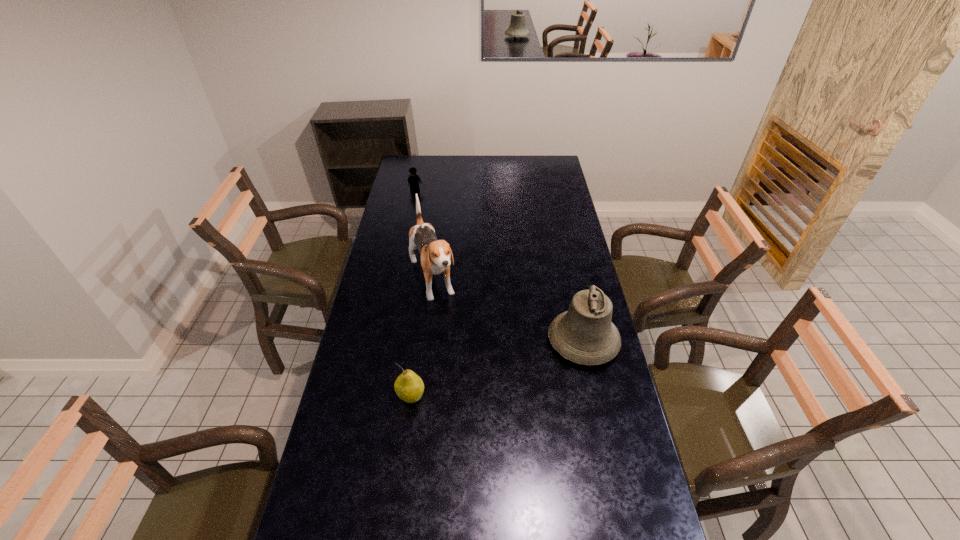
Locate an element on the screen. vacant space positioned 0.250m at the face of the tallest object is located at coordinates (461, 362).

Image resolution: width=960 pixels, height=540 pixels. Identify the location of vacant space located on the front-facing side of the farthest object. (424, 205).

Locate an element on the screen. This screenshot has width=960, height=540. blank space located on the front-facing side of the farthest object is located at coordinates (435, 223).

At what (x,y) coordinates should I click in order to perform the action: click on free space located on the front-facing side of the farthest object. Please return your answer as a coordinate pair (x, y). Looking at the image, I should click on (424, 205).

Identify the location of puppy that is at the left edge. (436, 254).

Find the location of a particular element. This screenshot has width=960, height=540. Lego situated at the left edge is located at coordinates (414, 180).

Where is `object that is at the right edge`? object that is at the right edge is located at coordinates (584, 334).

This screenshot has height=540, width=960. What are the coordinates of `vacant area at the far edge` in the screenshot? It's located at (495, 158).

The image size is (960, 540). In the image, there is a desktop. What are the coordinates of `free space at the near edge` in the screenshot? It's located at (508, 507).

At what (x,y) coordinates should I click in order to perform the action: click on free space at the left edge. Please return your answer as a coordinate pair (x, y). This screenshot has height=540, width=960. Looking at the image, I should click on (396, 220).